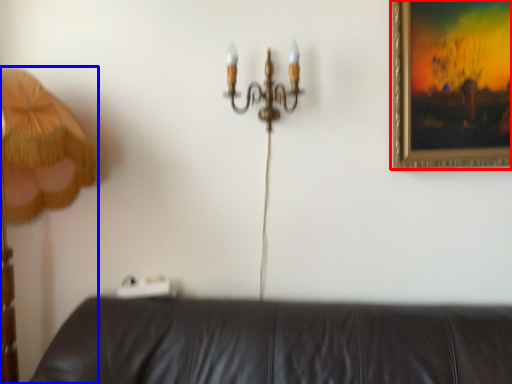
Question: Which object appears closest to the camera in this image, picture frame (highlighted by a red box) or lamp (highlighted by a blue box)?

Choices:
 (A) picture frame
 (B) lamp

Answer: (B)